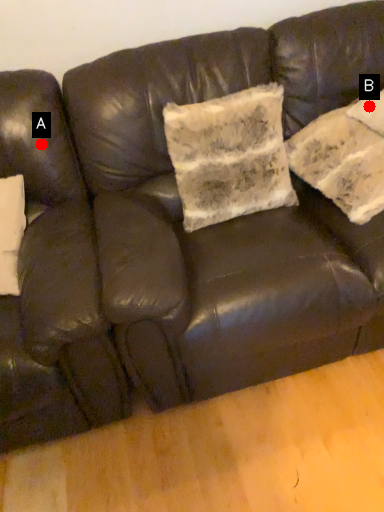
Question: Two points are circled on the image, labeled by A and B beside each circle. Which point is farther from the camera taking this photo?

Choices:
 (A) A is further
 (B) B is further

Answer: (B)